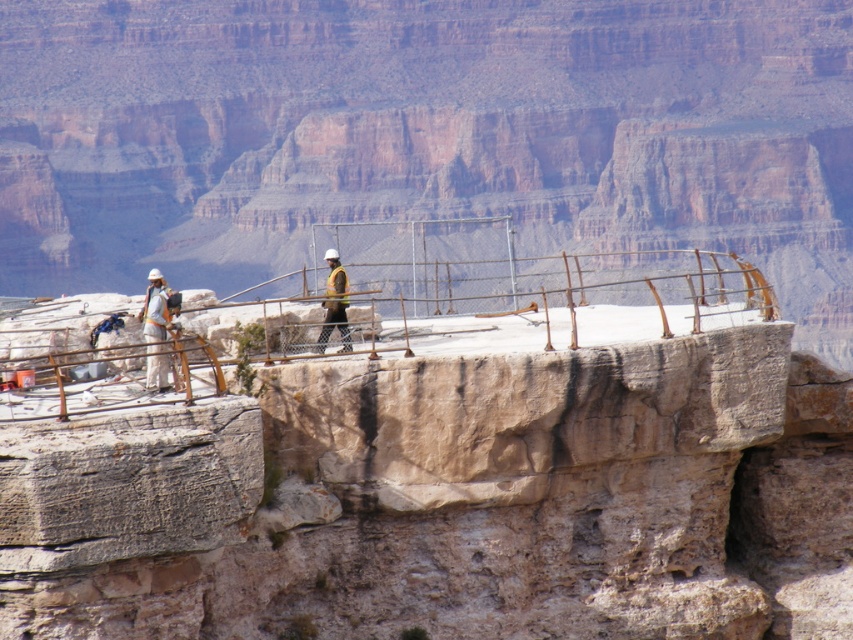
You are standing at the edge of the Grand Canyon platform and want to take a photo. There are two points marked on your map as point coordinates. Which point, point (547, 358) or point (334, 284), is closer to your current position on the platform?

Point (547, 358) is closer to the camera, so it is closer to your current position on the platform.

You are a safety inspector at the Grand Canyon platform. You notice two hard hats on the platform. Which one has a larger width, the white hard hat at left or the hard hat construction worker at center?

The white hard hat at left has a larger width than the hard hat construction worker at center since the white hard hat at left surpasses the hard hat construction worker at center in width.

Consider the image. You are a tourist standing at the edge of the Grand Canyon and see the smooth concrete platform at center and the hard hat construction worker at center. Which object is closer to you?

The smooth concrete platform at center is closer to you than the hard hat construction worker at center.